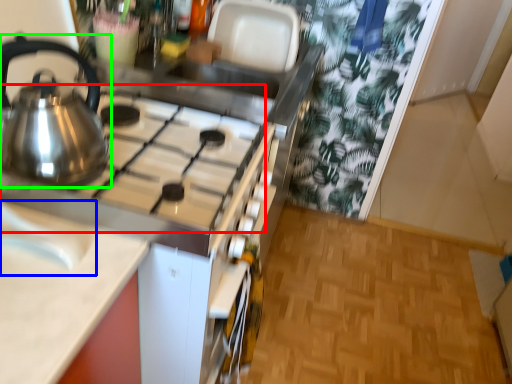
Question: Which is farther away from gas stove (highlighted by a red box)? sink (highlighted by a blue box) or kettle (highlighted by a green box)?

Choices:
 (A) sink
 (B) kettle

Answer: (A)